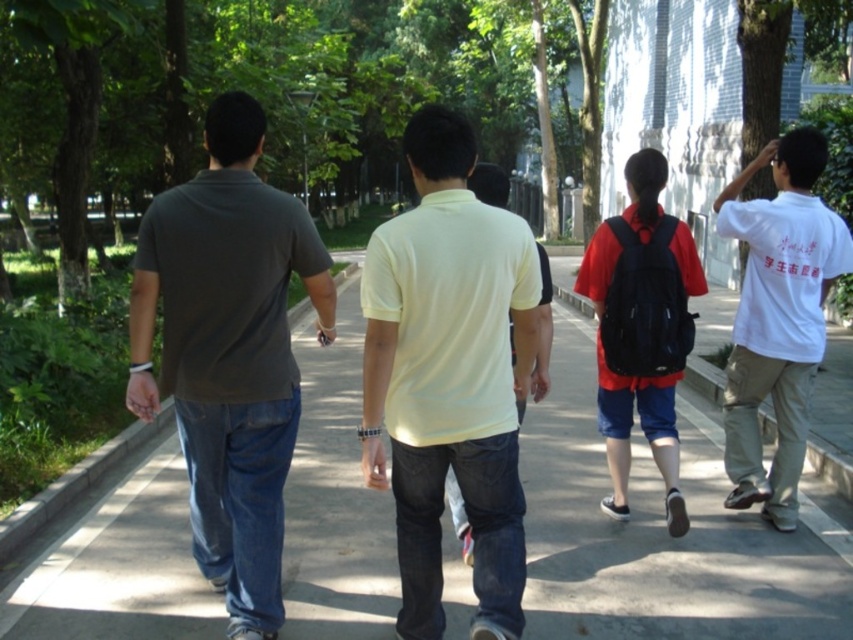
Question: Is yellow cotton shirt at center thinner than matte black backpack at center?

Choices:
 (A) yes
 (B) no

Answer: (B)

Question: Based on their relative distances, which object is nearer to the dark gray cotton t-shirt at left?

Choices:
 (A) white cotton shirt at right
 (B) yellow cotton shirt at center
 (C) matte black backpack at center

Answer: (B)

Question: Which of these objects is positioned closest to the white cotton shirt at right?

Choices:
 (A) matte black backpack at center
 (B) yellow cotton shirt at center
 (C) gray concrete pavement at center

Answer: (A)

Question: Which of these objects is positioned farthest from the white cotton shirt at right?

Choices:
 (A) dark gray cotton t-shirt at left
 (B) yellow cotton shirt at center
 (C) gray concrete pavement at center

Answer: (A)

Question: Is yellow cotton shirt at center above matte black backpack at center?

Choices:
 (A) yes
 (B) no

Answer: (B)

Question: Does gray concrete pavement at center appear on the left side of matte black backpack at center?

Choices:
 (A) yes
 (B) no

Answer: (A)